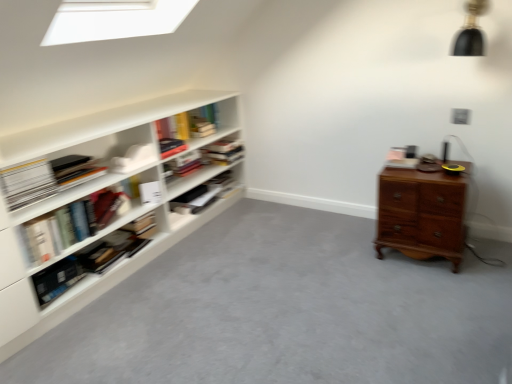
The image size is (512, 384). I want to click on free spot in front of wooden chest of drawers at right, so click(x=429, y=285).